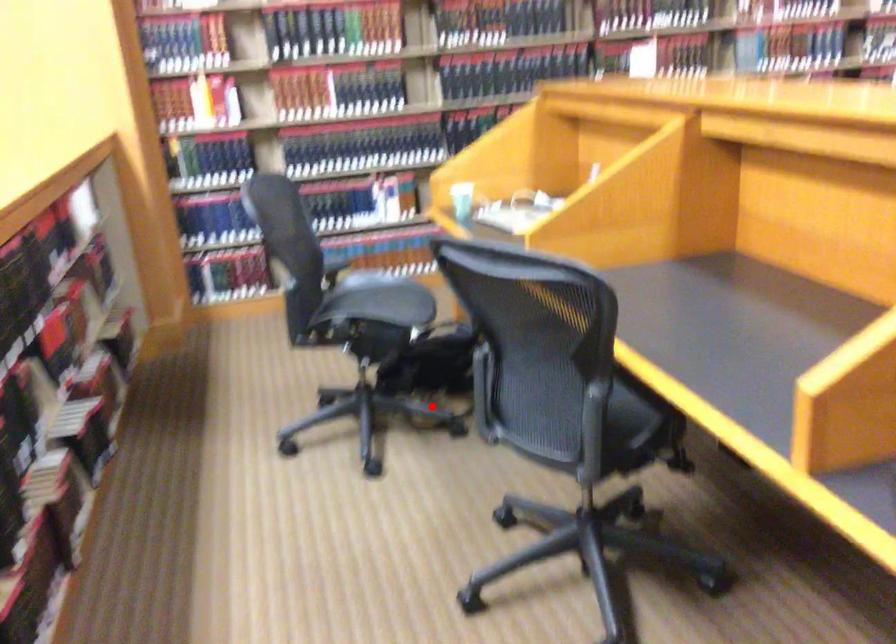
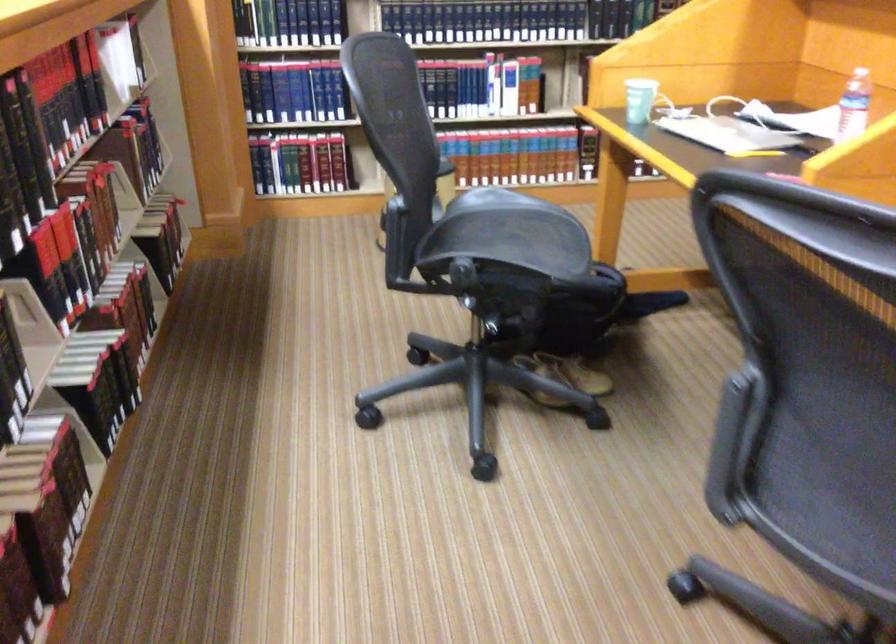
In the second image, find the point that corresponds to the highlighted location in the first image.

(564, 377)